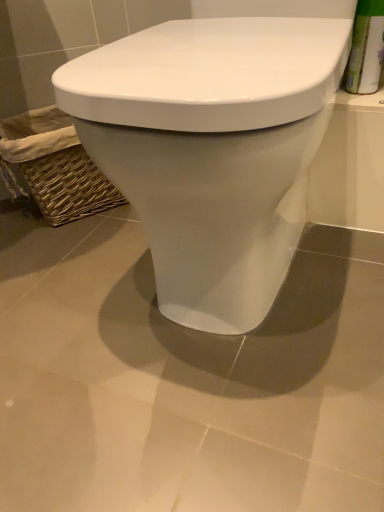
What do you see at coordinates (211, 150) in the screenshot? I see `white glossy toilet at center` at bounding box center [211, 150].

You are a GUI agent. You are given a task and a screenshot of the screen. Output one action in this format:
    pyautogui.click(x=<x>, y=<y>)
    Task: Click on the white glossy toilet at center
    The height and width of the screenshot is (512, 384).
    Given the screenshot: What is the action you would take?
    pyautogui.click(x=211, y=150)

You are a GUI agent. You are given a task and a screenshot of the screen. Output one action in this format:
    pyautogui.click(x=<x>, y=<y>)
    Task: Click on the woven brown basket at lower left
    
    Given the screenshot: What is the action you would take?
    pyautogui.click(x=54, y=166)

Image resolution: width=384 pixels, height=512 pixels. Describe the element at coordinates (54, 166) in the screenshot. I see `woven brown basket at lower left` at that location.

In order to face woven brown basket at lower left, should I rotate leftwards or rightwards?

Rotate left and turn 16.003 degrees.

At what (x,y) coordinates should I click in order to perform the action: click on white glossy toilet at center. Please return your answer as a coordinate pair (x, y). This screenshot has height=512, width=384. Looking at the image, I should click on (211, 150).

Is white glossy toilet at center at the right side of woven brown basket at lower left?

Yes, white glossy toilet at center is to the right of woven brown basket at lower left.

Between white glossy toilet at center and woven brown basket at lower left, which one is positioned behind?

→ Positioned behind is woven brown basket at lower left.

Does point (167, 197) lie behind point (101, 200)?

No, it is in front of (101, 200).

From the image's perspective, which one is positioned lower, white glossy toilet at center or woven brown basket at lower left?

From the image's view, white glossy toilet at center is below.

From a real-world perspective, between white glossy toilet at center and woven brown basket at lower left, who is vertically higher?

white glossy toilet at center is physically above.

Considering the relative sizes of white glossy toilet at center and woven brown basket at lower left in the image provided, is white glossy toilet at center wider than woven brown basket at lower left?

Yes.

Does white glossy toilet at center have a greater height compared to woven brown basket at lower left?

Yes, white glossy toilet at center is taller than woven brown basket at lower left.

Does white glossy toilet at center have a larger size compared to woven brown basket at lower left?

Yes, white glossy toilet at center is bigger than woven brown basket at lower left.

Is woven brown basket at lower left completely or partially inside white glossy toilet at center?

No, white glossy toilet at center does not contain woven brown basket at lower left.

Is white glossy toilet at center next to woven brown basket at lower left and touching it?

No, white glossy toilet at center is not beside woven brown basket at lower left.

Is woven brown basket at lower left at the back of white glossy toilet at center?

No, white glossy toilet at center is not facing the opposite direction of woven brown basket at lower left.

How different are the orientations of white glossy toilet at center and woven brown basket at lower left in degrees?

They differ by 53.6 degrees in their facing directions.

Image resolution: width=384 pixels, height=512 pixels. In order to click on toilet located above the woven brown basket at lower left (from a real-world perspective) in this screenshot , I will do `click(211, 150)`.

Is woven brown basket at lower left to the left of white glossy toilet at center from the viewer's perspective?

Correct, you'll find woven brown basket at lower left to the left of white glossy toilet at center.

Who is more distant, woven brown basket at lower left or white glossy toilet at center?

woven brown basket at lower left.

Between point (39, 167) and point (207, 249), which one is positioned in front?

The point (207, 249) is more forward.

From the image's perspective, is woven brown basket at lower left beneath white glossy toilet at center?

No.

From a real-world perspective, between woven brown basket at lower left and white glossy toilet at center, who is vertically lower?

From a 3D spatial view, woven brown basket at lower left is below.

Between woven brown basket at lower left and white glossy toilet at center, which one has larger width?

white glossy toilet at center.

Can you confirm if woven brown basket at lower left is taller than white glossy toilet at center?

In fact, woven brown basket at lower left may be shorter than white glossy toilet at center.

Looking at the image, does woven brown basket at lower left seem bigger or smaller compared to white glossy toilet at center?

Clearly, woven brown basket at lower left is smaller in size than white glossy toilet at center.

Based on the photo, would you say white glossy toilet at center is part of woven brown basket at lower left's contents?

No, white glossy toilet at center is not a part of woven brown basket at lower left.

Is woven brown basket at lower left placed right next to white glossy toilet at center?

No, woven brown basket at lower left is not in contact with white glossy toilet at center.

Is woven brown basket at lower left turned away from white glossy toilet at center?

No, woven brown basket at lower left is not facing away from white glossy toilet at center.

How many degrees apart are the facing directions of woven brown basket at lower left and white glossy toilet at center?

There is a 53.6-degree angle between the facing directions of woven brown basket at lower left and white glossy toilet at center.

How distant is woven brown basket at lower left from white glossy toilet at center?

woven brown basket at lower left and white glossy toilet at center are 21.08 inches apart from each other.

Identify the location of basket on the left of the white glossy toilet at center. (54, 166).

This screenshot has height=512, width=384. Identify the location of basket behind the white glossy toilet at center. (54, 166).

At what (x,y) coordinates should I click in order to perform the action: click on toilet in front of the woven brown basket at lower left. Please return your answer as a coordinate pair (x, y). This screenshot has height=512, width=384. Looking at the image, I should click on (211, 150).